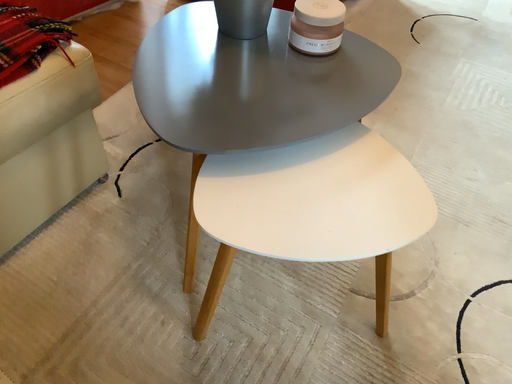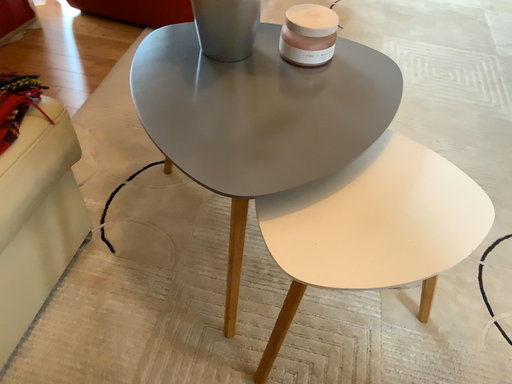
Question: How did the camera likely rotate when shooting the video?

Choices:
 (A) rotated right
 (B) rotated left

Answer: (A)